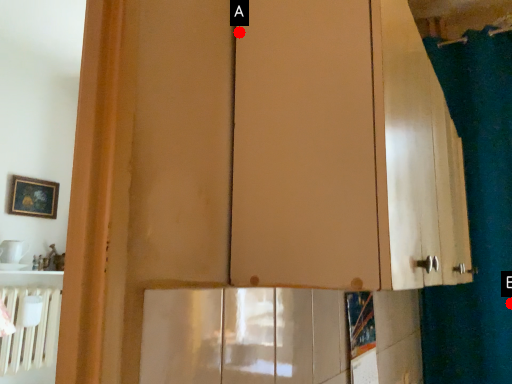
Question: Two points are circled on the image, labeled by A and B beside each circle. Which point is farther from the camera taking this photo?

Choices:
 (A) A is further
 (B) B is further

Answer: (B)